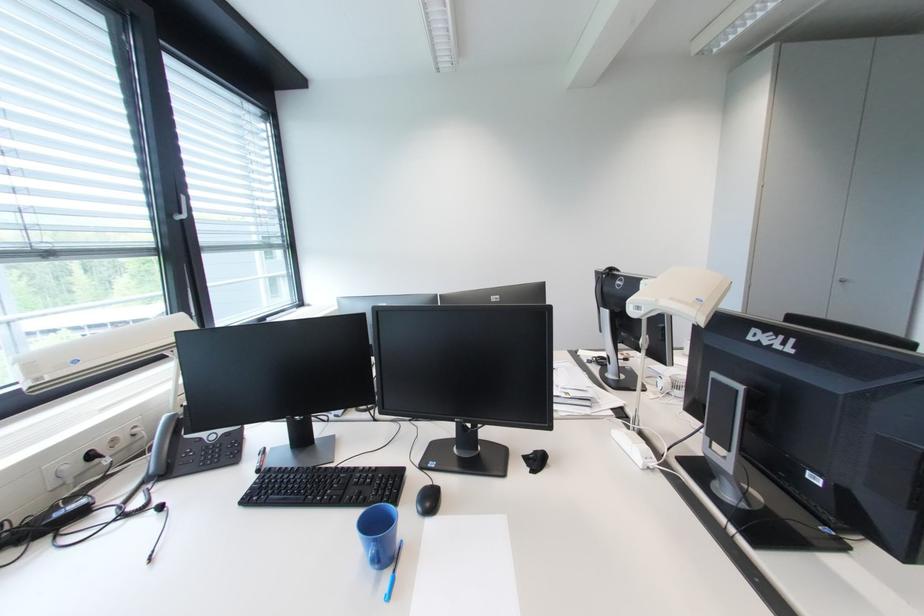
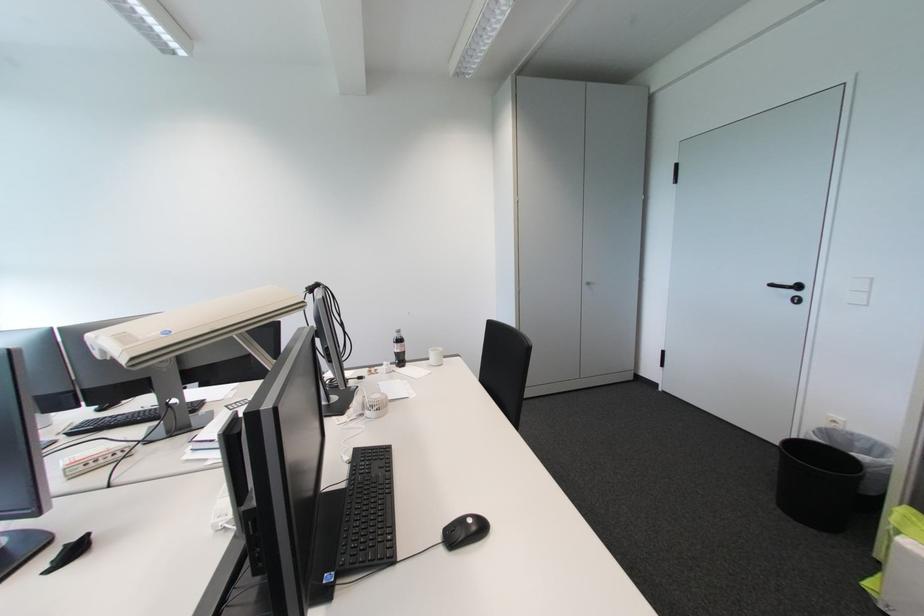
Question: The camera is either moving clockwise (left) or counter-clockwise (right) around the object. The first image is from the beginning of the video and the second image is from the end. Is the camera moving left or right when shooting the video?

Choices:
 (A) Left
 (B) Right

Answer: (A)